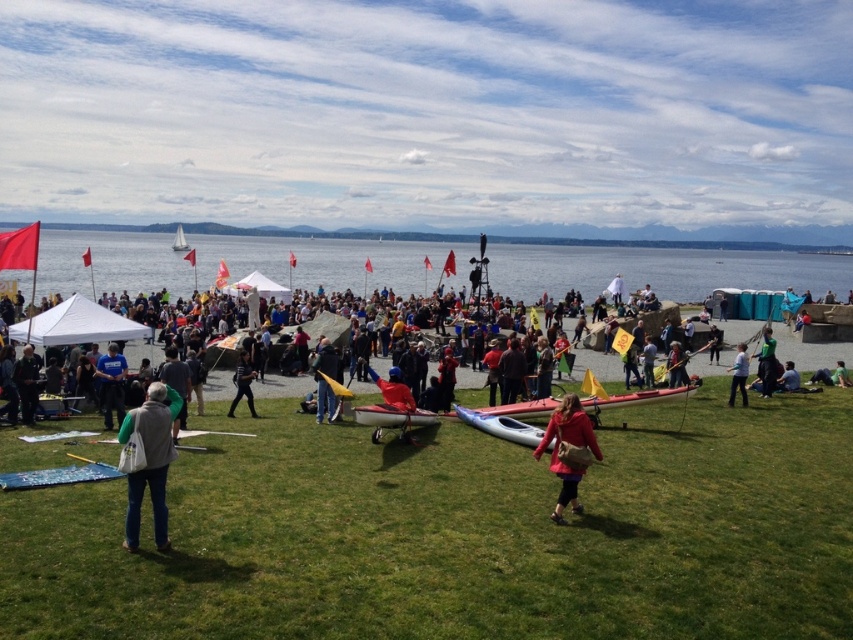
Question: Which point is closer to the camera taking this photo?

Choices:
 (A) pos(537,298)
 (B) pos(254,413)
 (C) pos(161,413)
 (D) pos(549,440)

Answer: (C)

Question: Which point is closer to the camera?

Choices:
 (A) dark blue jeans at center
 (B) blue fabric shirt at center
 (C) green grass at lower center

Answer: (C)

Question: Can you confirm if matte pink coat at center is positioned below green fabric jacket at lower center?

Choices:
 (A) yes
 (B) no

Answer: (A)

Question: Which object appears farthest from the camera in this image?

Choices:
 (A) clear blue water at center
 (B) dark blue jeans at center
 (C) matte pink coat at center
 (D) green fabric jacket at lower center

Answer: (A)

Question: Can you confirm if blue fabric shirt at center is smaller than orange fabric kayak at center?

Choices:
 (A) no
 (B) yes

Answer: (A)

Question: Is matte pink coat at center positioned in front of orange fabric kayak at center?

Choices:
 (A) yes
 (B) no

Answer: (A)